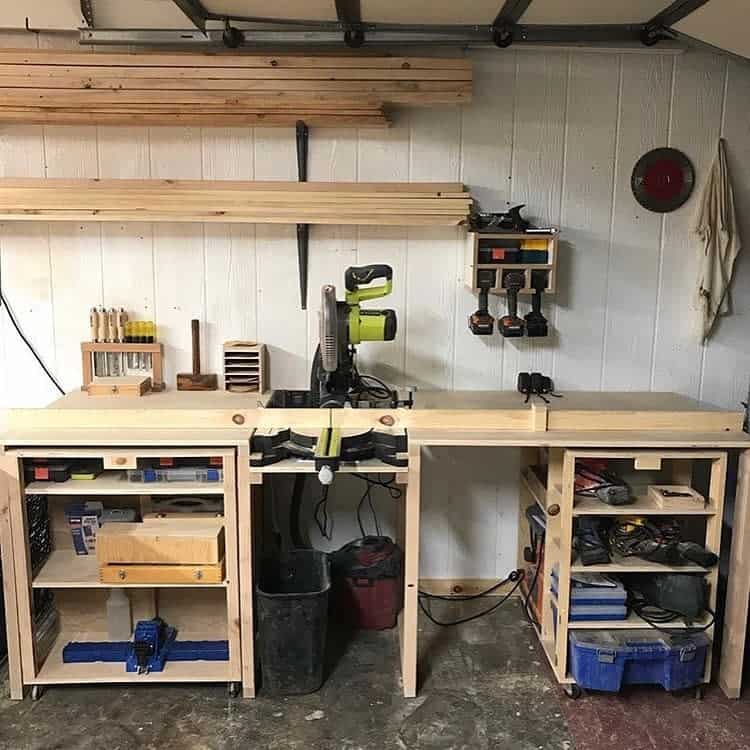
What are the coordinates of `power cord` in the screenshot? It's located at (31, 346).